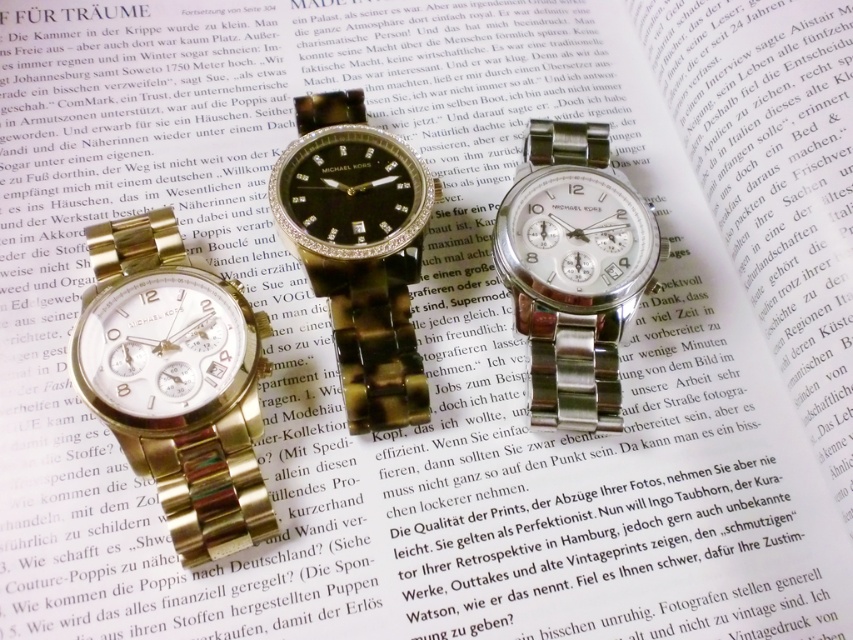
Between point (397, 355) and point (570, 189), which one is positioned in front?

Point (397, 355)

Which is more to the left, black crystal watch at center or satin silver watch at center?

black crystal watch at center is more to the left.

Between point (351, 291) and point (590, 156), which one is positioned in front?

Point (351, 291) is more forward.

Locate an element on the screen. black crystal watch at center is located at coordinates (358, 250).

Describe the element at coordinates (177, 381) in the screenshot. I see `gold metallic watch at left` at that location.

Is point (190, 422) less distant than point (567, 196)?

Yes, it is.

Which is in front, point (154, 264) or point (546, 339)?

Point (154, 264)

You are a GUI agent. You are given a task and a screenshot of the screen. Output one action in this format:
    pyautogui.click(x=<x>, y=<y>)
    Task: Click on the gold metallic watch at left
    
    Given the screenshot: What is the action you would take?
    pyautogui.click(x=177, y=381)

Can you confirm if gold metallic watch at left is positioned to the right of black crystal watch at center?

In fact, gold metallic watch at left is to the left of black crystal watch at center.

Identify the location of gold metallic watch at left. (177, 381).